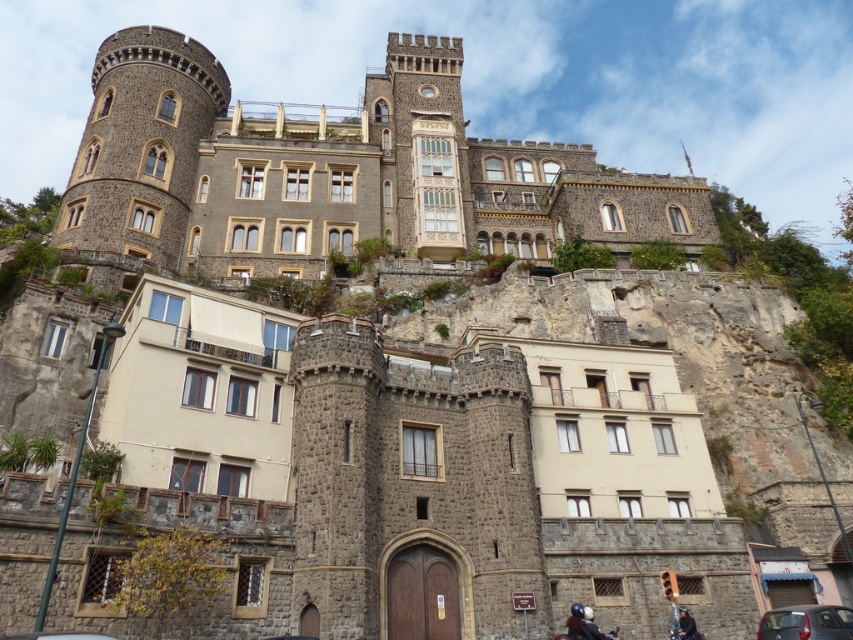
Between point (795, 621) and point (616, 634), which one is positioned in front?

Positioned in front is point (795, 621).

Is point (836, 605) less distant than point (610, 634)?

Yes, it is in front of point (610, 634).

Where is `matte black car at lower right`? This screenshot has height=640, width=853. matte black car at lower right is located at coordinates (805, 621).

Where is `matte black car at lower right`? This screenshot has width=853, height=640. matte black car at lower right is located at coordinates (805, 621).

Is point (320, 182) farther from viewer compared to point (801, 614)?

Yes, point (320, 182) is farther from viewer.

Which of these two, dark gray stone castle at upper center or matte black car at lower right, stands shorter?

With less height is matte black car at lower right.

This screenshot has width=853, height=640. What do you see at coordinates (332, 172) in the screenshot? I see `dark gray stone castle at upper center` at bounding box center [332, 172].

Where is `dark gray stone castle at upper center`? This screenshot has width=853, height=640. dark gray stone castle at upper center is located at coordinates pyautogui.click(x=332, y=172).

Consider the image. Who is lower down, matte black car at lower right or dark gray leather jacket at lower right?

dark gray leather jacket at lower right

Between matte black car at lower right and dark gray leather jacket at lower right, which one has less height?

dark gray leather jacket at lower right

Which is behind, point (799, 632) or point (683, 616)?

Point (683, 616)

Where is `matte black car at lower right`? matte black car at lower right is located at coordinates (805, 621).